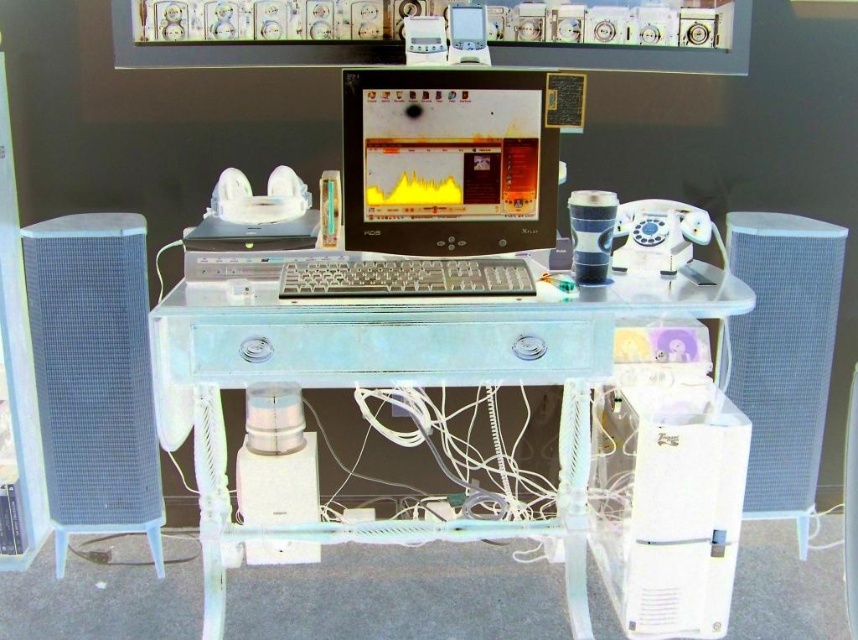
Question: Can you confirm if clear acrylic desk at center is wider than white mesh speaker at left?

Choices:
 (A) yes
 (B) no

Answer: (A)

Question: Which of these objects is positioned farthest from the matte black monitor at center?

Choices:
 (A) white plastic speaker at lower center
 (B) clear plastic keyboard at center
 (C) clear acrylic desk at center

Answer: (A)

Question: Where is clear acrylic desk at center located in relation to clear plastic keyboard at center in the image?

Choices:
 (A) above
 (B) below

Answer: (B)

Question: Observing the image, what is the correct spatial positioning of clear acrylic desk at center in reference to white plastic speaker at lower center?

Choices:
 (A) left
 (B) right

Answer: (B)

Question: Which object appears farthest from the camera in this image?

Choices:
 (A) white plastic speaker at lower center
 (B) clear plastic keyboard at center

Answer: (A)

Question: Which is farther from the clear plastic keyboard at center?

Choices:
 (A) white plastic speaker at lower center
 (B) matte black monitor at center
 (C) white mesh speaker at left
 (D) clear acrylic desk at center

Answer: (C)